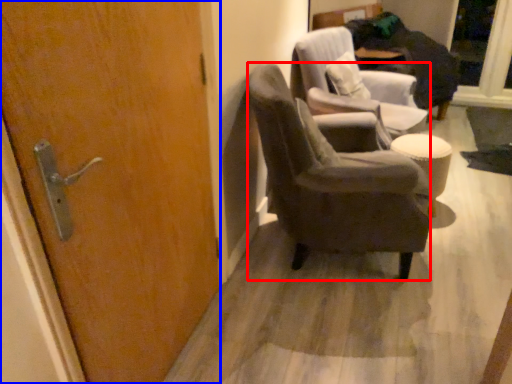
Question: Which object appears closest to the camera in this image, chair (highlighted by a red box) or door (highlighted by a blue box)?

Choices:
 (A) chair
 (B) door

Answer: (B)